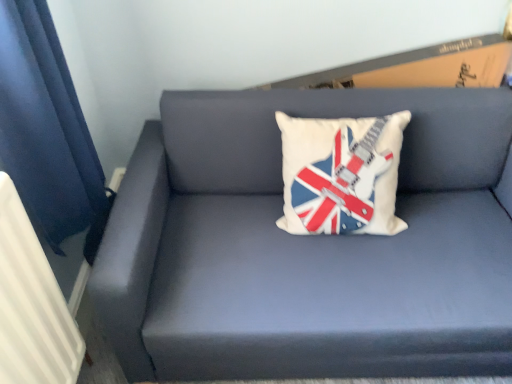
Question: Does matte blue couch at center have a larger size compared to white fabric pillow with guitar and flag design at center?

Choices:
 (A) yes
 (B) no

Answer: (A)

Question: Does matte blue couch at center have a smaller size compared to white fabric pillow with guitar and flag design at center?

Choices:
 (A) yes
 (B) no

Answer: (B)

Question: Is white fabric pillow with guitar and flag design at center inside matte blue couch at center?

Choices:
 (A) yes
 (B) no

Answer: (A)

Question: Is matte blue couch at center aimed at white fabric pillow with guitar and flag design at center?

Choices:
 (A) yes
 (B) no

Answer: (A)

Question: Can you confirm if matte blue couch at center is positioned to the right of white fabric pillow with guitar and flag design at center?

Choices:
 (A) no
 (B) yes

Answer: (B)

Question: From the image's perspective, is white textured radiator at left above or below white fabric pillow with guitar and flag design at center?

Choices:
 (A) above
 (B) below

Answer: (B)

Question: Is white textured radiator at left spatially inside white fabric pillow with guitar and flag design at center, or outside of it?

Choices:
 (A) outside
 (B) inside

Answer: (A)

Question: Is white textured radiator at left taller or shorter than white fabric pillow with guitar and flag design at center?

Choices:
 (A) tall
 (B) short

Answer: (A)

Question: From a real-world perspective, is white textured radiator at left physically located above or below white fabric pillow with guitar and flag design at center?

Choices:
 (A) above
 (B) below

Answer: (B)

Question: From a real-world perspective, relative to white fabric pillow with guitar and flag design at center, is matte blue couch at center vertically above or below?

Choices:
 (A) below
 (B) above

Answer: (A)

Question: Is matte blue couch at center bigger or smaller than white fabric pillow with guitar and flag design at center?

Choices:
 (A) big
 (B) small

Answer: (A)

Question: Is point (318, 112) closer or farther from the camera than point (289, 168)?

Choices:
 (A) farther
 (B) closer

Answer: (A)

Question: In terms of height, does matte blue couch at center look taller or shorter compared to white fabric pillow with guitar and flag design at center?

Choices:
 (A) short
 (B) tall

Answer: (B)

Question: In terms of height, does matte blue couch at center look taller or shorter compared to white textured radiator at left?

Choices:
 (A) short
 (B) tall

Answer: (A)

Question: Is matte blue couch at center spatially inside white textured radiator at left, or outside of it?

Choices:
 (A) outside
 (B) inside

Answer: (A)